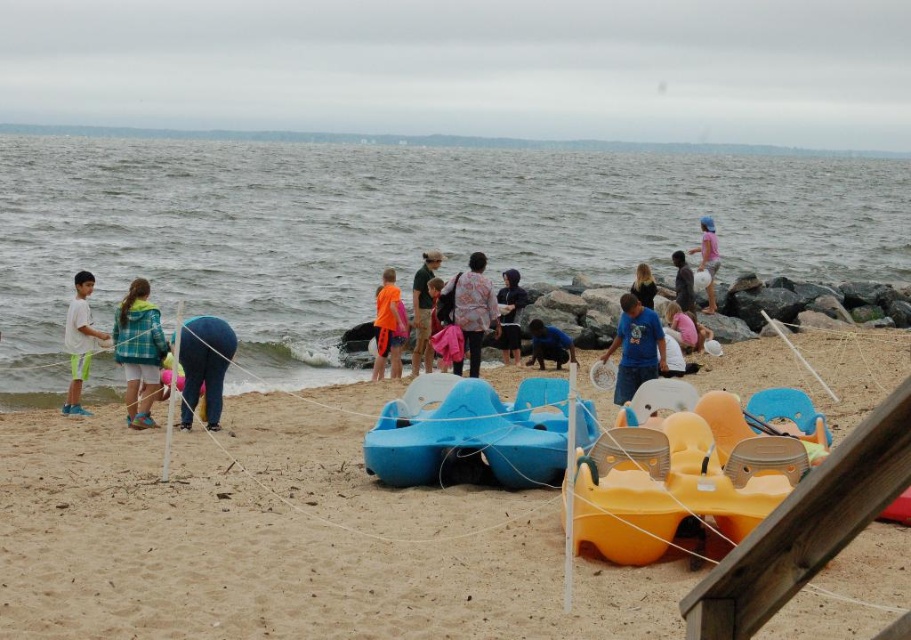
Does yellow plastic boat at center have a smaller size compared to blue denim jeans at lower left?

Actually, yellow plastic boat at center might be larger than blue denim jeans at lower left.

Is yellow plastic boat at center taller than blue denim jeans at lower left?

Incorrect, yellow plastic boat at center's height is not larger of blue denim jeans at lower left's.

Is point (630, 436) positioned after point (197, 340)?

No, it is in front of (197, 340).

Identify the location of yellow plastic boat at center. Image resolution: width=911 pixels, height=640 pixels. (691, 468).

Is orange fabric shirt at center closer to the viewer compared to pink fabric dress at upper center?

Yes, orange fabric shirt at center is closer to the viewer.

Find the location of a particular element. orange fabric shirt at center is located at coordinates (387, 324).

What do you see at coordinates (387, 324) in the screenshot?
I see `orange fabric shirt at center` at bounding box center [387, 324].

The image size is (911, 640). Identify the location of orange fabric shirt at center. (387, 324).

Between white cotton shirt at left and blonde hair at upper center, which one is positioned lower?

white cotton shirt at left is below.

Is point (70, 332) less distant than point (648, 268)?

Yes, it is.

Where is `white cotton shirt at left`? The height and width of the screenshot is (640, 911). white cotton shirt at left is located at coordinates (79, 340).